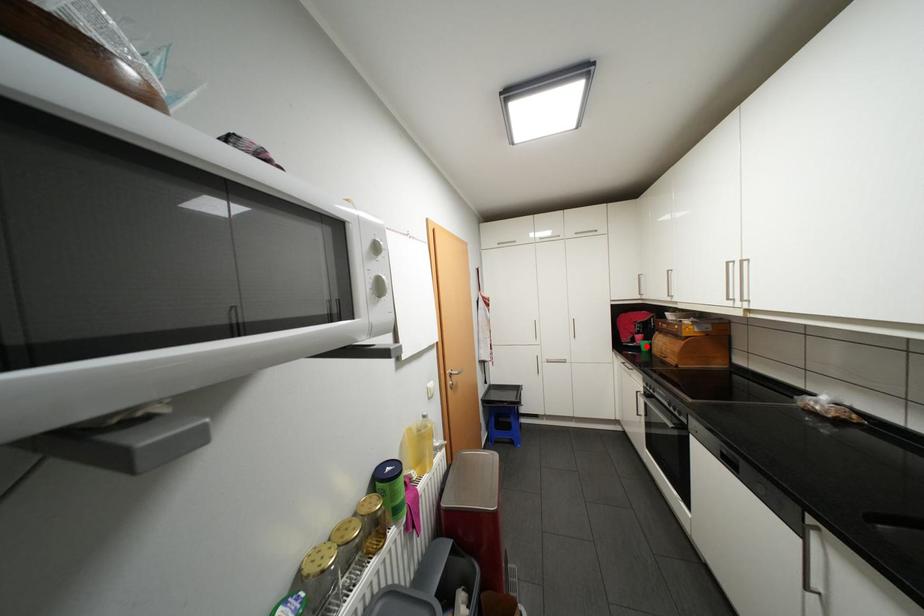
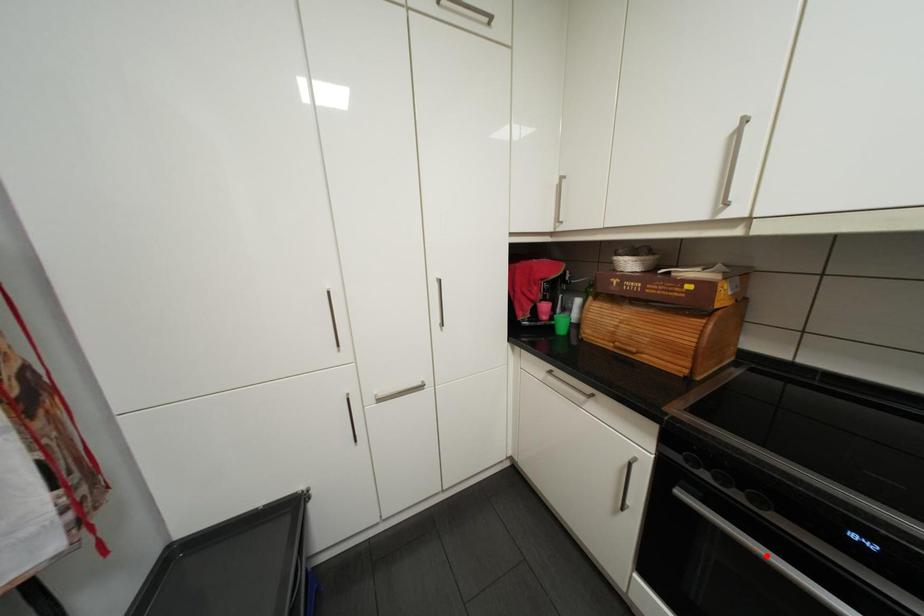
I am providing you with two images of the same scene from different viewpoints. A red point is marked on the first image and another point is marked on the second image. Does the point marked in image1 correspond to the same location as the one in image2?

No